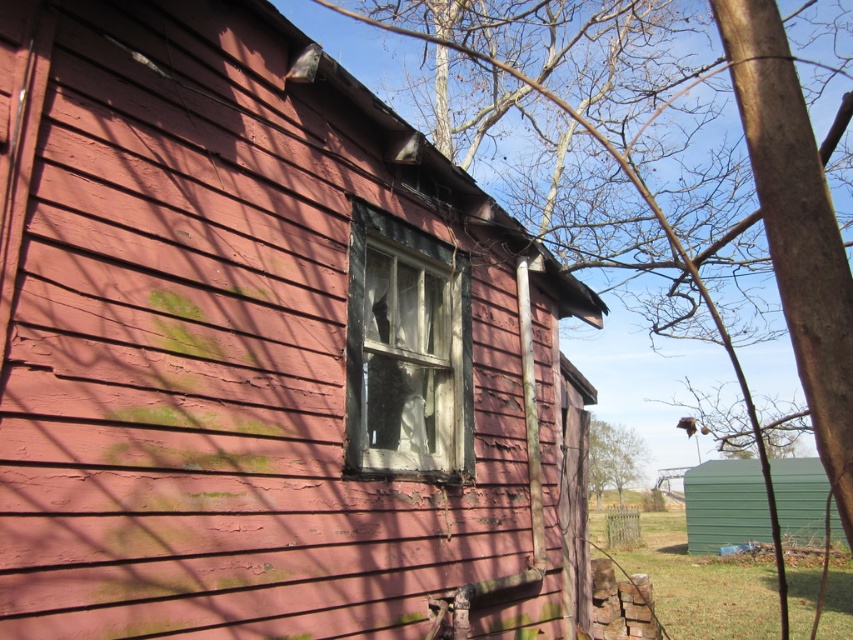
In the scene shown: Does peeling paint wooden hut at center have a larger size compared to green corrugated metal hut at lower right?

Correct, peeling paint wooden hut at center is larger in size than green corrugated metal hut at lower right.

This screenshot has width=853, height=640. What are the coordinates of `peeling paint wooden hut at center` in the screenshot? It's located at (258, 344).

Can you confirm if green corrugated metal hut at lower right is shorter than green leafy tree at center?

Correct, green corrugated metal hut at lower right is not as tall as green leafy tree at center.

In the scene shown: Can you confirm if green corrugated metal hut at lower right is thinner than green leafy tree at center?

Correct, green corrugated metal hut at lower right's width is less than green leafy tree at center's.

The height and width of the screenshot is (640, 853). What are the coordinates of `green corrugated metal hut at lower right` in the screenshot? It's located at (724, 504).

Consider the image. Is peeling paint wooden hut at center smaller than green leafy tree at center?

Correct, peeling paint wooden hut at center occupies less space than green leafy tree at center.

Who is more forward, (265, 458) or (635, 444)?

Point (265, 458)

Locate an element on the screen. peeling paint wooden hut at center is located at coordinates (258, 344).